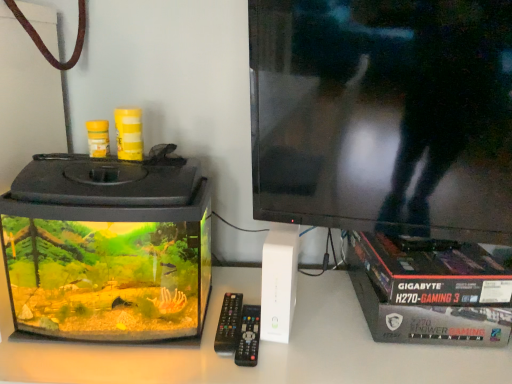
Where is `black plastic remote at center`? black plastic remote at center is located at coordinates (249, 336).

The height and width of the screenshot is (384, 512). Describe the element at coordinates (249, 336) in the screenshot. I see `black plastic remote at center` at that location.

You are a GUI agent. You are given a task and a screenshot of the screen. Output one action in this format:
    pyautogui.click(x=<x>, y=<y>)
    Task: Click on the transparent glass aquarium at left
    The width and height of the screenshot is (512, 384).
    Given the screenshot: What is the action you would take?
    pyautogui.click(x=108, y=252)

The width and height of the screenshot is (512, 384). Describe the element at coordinates (108, 252) in the screenshot. I see `transparent glass aquarium at left` at that location.

The width and height of the screenshot is (512, 384). What are the coordinates of `black plastic remote at center` in the screenshot? It's located at (249, 336).

Is transparent glass aquarium at left at the left side of black plastic remote at center?

Indeed, transparent glass aquarium at left is positioned on the left side of black plastic remote at center.

Looking at this image, considering the relative positions of transparent glass aquarium at left and black plastic remote at center in the image provided, is transparent glass aquarium at left behind black plastic remote at center?

No, transparent glass aquarium at left is in front of black plastic remote at center.

Between point (178, 198) and point (248, 314), which one is positioned behind?

The point (248, 314) is behind.

From the image's perspective, is transparent glass aquarium at left over black plastic remote at center?

Yes, from the image's perspective, transparent glass aquarium at left is on top of black plastic remote at center.

From a real-world perspective, is transparent glass aquarium at left located higher than black plastic remote at center?

Indeed, from a real-world perspective, transparent glass aquarium at left stands above black plastic remote at center.

Does transparent glass aquarium at left have a greater width compared to black plastic remote at center?

Yes.

Between transparent glass aquarium at left and black plastic remote at center, which one has more height?

Standing taller between the two is transparent glass aquarium at left.

Does transparent glass aquarium at left have a larger size compared to black plastic remote at center?

Yes, transparent glass aquarium at left is bigger than black plastic remote at center.

Is black plastic remote at center surrounded by transparent glass aquarium at left?

No, black plastic remote at center is not a part of transparent glass aquarium at left.

Is transparent glass aquarium at left directly adjacent to black plastic remote at center?

No, transparent glass aquarium at left is not with black plastic remote at center.

Is transparent glass aquarium at left oriented away from black plastic remote at center?

No, black plastic remote at center is not at the back of transparent glass aquarium at left.

How many degrees apart are the facing directions of transparent glass aquarium at left and black plastic remote at center?

1.54 degrees.

The height and width of the screenshot is (384, 512). Identify the location of control on the right of transparent glass aquarium at left. (249, 336).

Which object is positioned more to the right, black plastic remote at center or transparent glass aquarium at left?

Positioned to the right is black plastic remote at center.

Relative to transparent glass aquarium at left, is black plastic remote at center in front or behind?

black plastic remote at center is behind transparent glass aquarium at left.

In the scene shown: Which is further, (x=241, y=338) or (x=170, y=249)?

The point (x=241, y=338) is farther.

From the image's perspective, is black plastic remote at center positioned above or below transparent glass aquarium at left?

Based on their image positions, black plastic remote at center is located beneath transparent glass aquarium at left.

From a real-world perspective, is black plastic remote at center above or below transparent glass aquarium at left?

black plastic remote at center is below transparent glass aquarium at left.

Looking at their sizes, would you say black plastic remote at center is wider or thinner than transparent glass aquarium at left?

Clearly, black plastic remote at center has less width compared to transparent glass aquarium at left.

Considering the sizes of black plastic remote at center and transparent glass aquarium at left in the image, is black plastic remote at center taller or shorter than transparent glass aquarium at left?

In the image, black plastic remote at center appears to be shorter than transparent glass aquarium at left.

Is black plastic remote at center bigger than transparent glass aquarium at left?

No.

Would you say black plastic remote at center is inside or outside transparent glass aquarium at left?

black plastic remote at center is outside transparent glass aquarium at left.

Are black plastic remote at center and transparent glass aquarium at left beside each other?

There is a gap between black plastic remote at center and transparent glass aquarium at left.

Is black plastic remote at center oriented towards transparent glass aquarium at left?

No.

At what (x,y) coordinates should I click in order to perform the action: click on appliance that appears above the black plastic remote at center (from a real-world perspective). Please return your answer as a coordinate pair (x, y). Looking at the image, I should click on (108, 252).

Identify the location of appliance that is on the left side of black plastic remote at center. The width and height of the screenshot is (512, 384). (108, 252).

Locate an element on the screen. appliance positioned vertically above the black plastic remote at center (from a real-world perspective) is located at coordinates (108, 252).